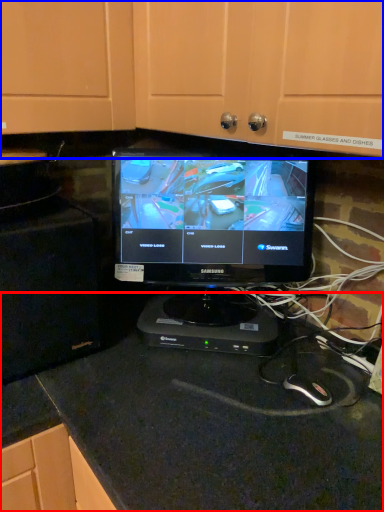
Question: Which object is closer to the camera taking this photo, counter top (highlighted by a red box) or dresser (highlighted by a blue box)?

Choices:
 (A) counter top
 (B) dresser

Answer: (B)